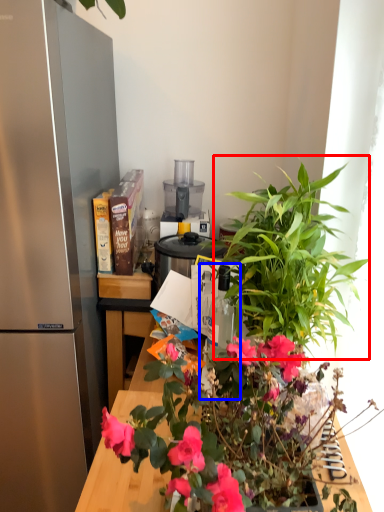
Question: Among these objects, which one is farthest to the camera, vegetation (highlighted by a red box) or bottle (highlighted by a blue box)?

Choices:
 (A) vegetation
 (B) bottle

Answer: (B)